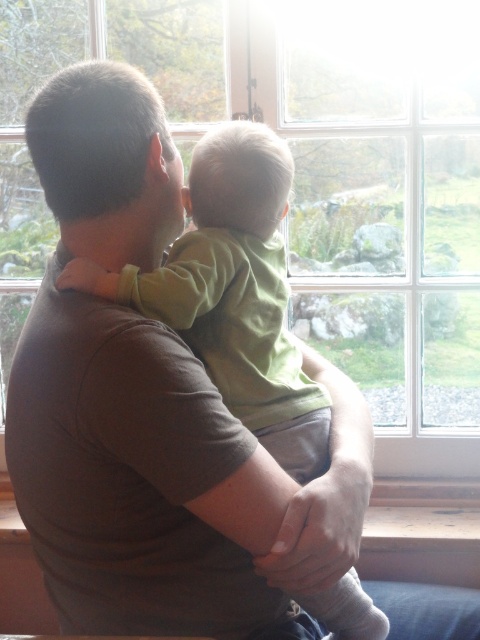
Question: Is transparent glass window at center below green matte shirt at center?

Choices:
 (A) no
 (B) yes

Answer: (A)

Question: Does transparent glass window at center lie behind green matte shirt at center?

Choices:
 (A) no
 (B) yes

Answer: (B)

Question: Which of the following is the closest to the observer?

Choices:
 (A) (424, 196)
 (B) (249, 360)

Answer: (B)

Question: Does transparent glass window at center appear on the right side of green matte shirt at center?

Choices:
 (A) no
 (B) yes

Answer: (B)

Question: Among these points, which one is nearest to the camera?

Choices:
 (A) (203, 324)
 (B) (370, 404)

Answer: (A)